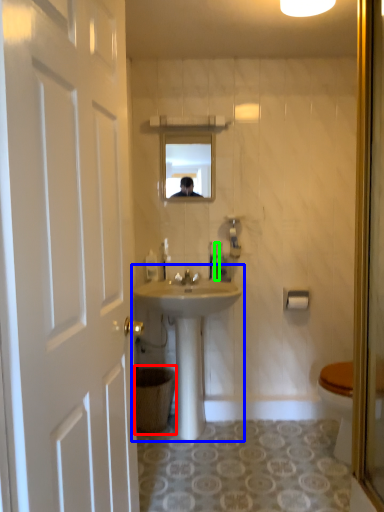
Question: Which object is positioned closest to trash bin/can (highlighted by a red box)? Select from sink (highlighted by a blue box) and toiletries (highlighted by a green box).

Choices:
 (A) sink
 (B) toiletries

Answer: (A)